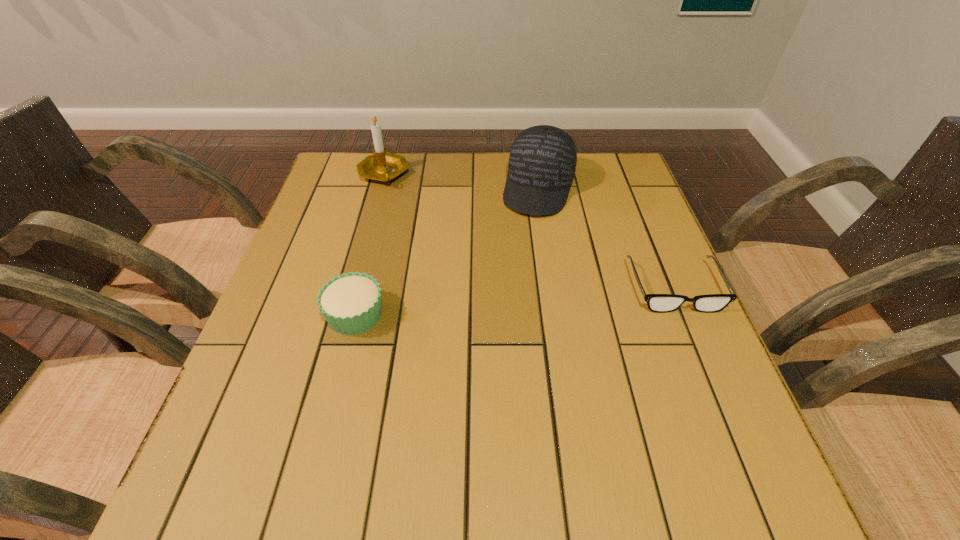
Image resolution: width=960 pixels, height=540 pixels. I want to click on free space located 0.320m at the front of the baseball cap where the brim is located, so click(x=504, y=309).

This screenshot has width=960, height=540. In order to click on vacant space located at the front of the baseball cap where the brim is located in this screenshot , I will do tap(506, 302).

You are a GUI agent. You are given a task and a screenshot of the screen. Output one action in this format:
    pyautogui.click(x=<x>, y=<y>)
    Task: Click on the vacant region located 0.150m at the front of the baseball cap where the brim is located
    The width and height of the screenshot is (960, 540).
    Given the screenshot: What is the action you would take?
    pyautogui.click(x=520, y=256)

I want to click on candle holder located at the far edge, so click(382, 166).

Find the location of a particular element. Image resolution: width=960 pixels, height=540 pixels. baseball cap that is at the far edge is located at coordinates (542, 162).

Where is `cupcake that is at the left edge`? Image resolution: width=960 pixels, height=540 pixels. cupcake that is at the left edge is located at coordinates (351, 303).

I want to click on candle holder present at the left edge, so click(x=382, y=166).

Where is `object present at the right edge`? object present at the right edge is located at coordinates (661, 303).

The image size is (960, 540). Identify the location of object positioned at the far left corner. (382, 166).

In the image, there is a desktop. Where is `vacant space at the far edge`? Image resolution: width=960 pixels, height=540 pixels. vacant space at the far edge is located at coordinates click(466, 153).